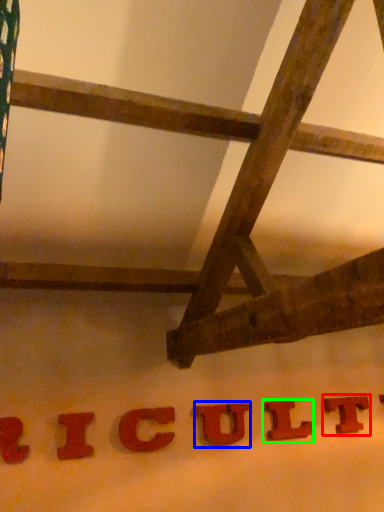
Question: Which is nearer to the letter (highlighted by a red box)? letter (highlighted by a blue box) or letter (highlighted by a green box).

Choices:
 (A) letter
 (B) letter

Answer: (B)